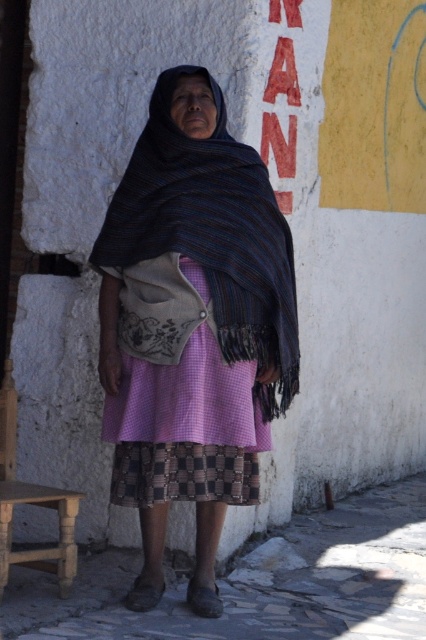
From the picture: You are an artist trying to sketch this scene. You notice the pink checkered dress at center and the red painted sign at upper center. Which object should you draw first if you want to focus on the larger one first?

The pink checkered dress at center has a larger size compared to the red painted sign at upper center, so you should draw the pink checkered dress at center first.

From the picture: You are a fashion designer observing the elderly woman in the scene. You need to determine if the pink checkered dress at center can be seen fully from the top of the red painted sign at upper center. Can you confirm this?

The pink checkered dress at center is taller than the red painted sign at upper center, so the dress extends above the sign, meaning the top of the dress can be seen beyond the sign.